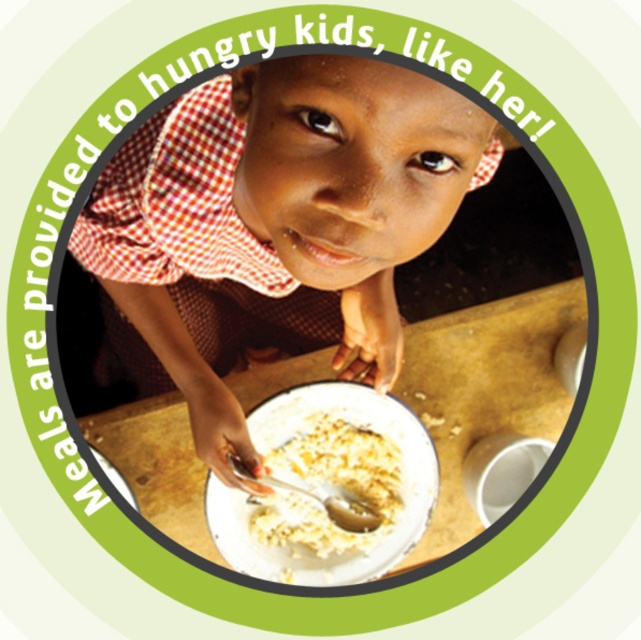
Question: Can you confirm if matte brown shirt at center is positioned below white matte porridge at center?

Choices:
 (A) no
 (B) yes

Answer: (A)

Question: Among these points, which one is farthest from the camera?

Choices:
 (A) (108, 209)
 (B) (383, 528)
 (C) (185, 515)

Answer: (C)

Question: Is matte brown shirt at center further to the viewer compared to white glossy plate at center?

Choices:
 (A) yes
 (B) no

Answer: (B)

Question: Can you confirm if white glossy plate at center is bigger than white matte porridge at center?

Choices:
 (A) no
 (B) yes

Answer: (B)

Question: Based on their relative distances, which object is nearer to the white matte porridge at center?

Choices:
 (A) matte brown shirt at center
 (B) white glossy plate at center

Answer: (B)

Question: Which object is the closest to the white glossy plate at center?

Choices:
 (A) white matte porridge at center
 (B) matte brown shirt at center

Answer: (A)